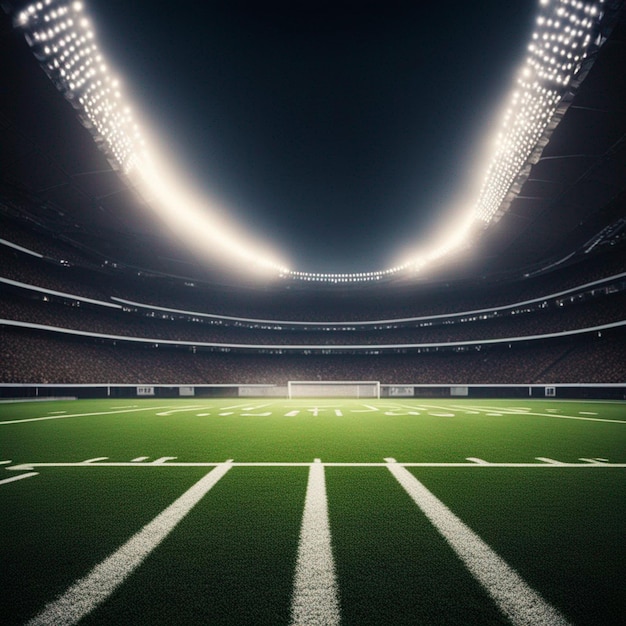
This screenshot has width=626, height=626. I want to click on background lights, so click(225, 347), click(274, 351), click(365, 347), click(459, 345), click(573, 295), click(367, 321), click(207, 317), click(149, 309).